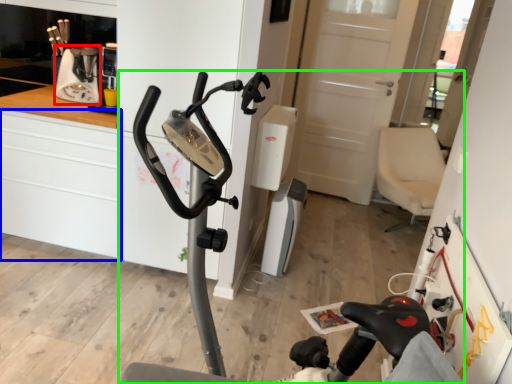
Question: Based on their relative distances, which object is nearer to coffee machine (highlighted by a red box)? Choose from cabinetry (highlighted by a blue box) and stationary bicycle (highlighted by a green box).

Choices:
 (A) cabinetry
 (B) stationary bicycle

Answer: (A)